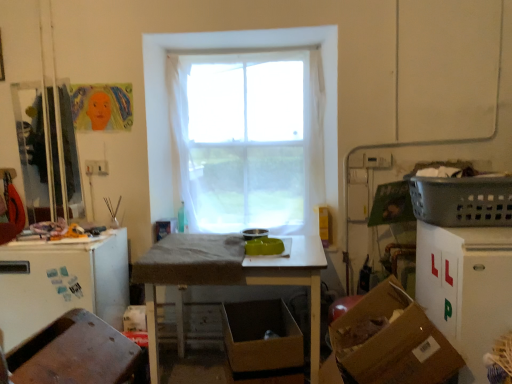
Question: Is brown cardboard box at lower right, acting as the 1th cardboard box starting from the front, surrounded by gray plastic laundry basket at right?

Choices:
 (A) no
 (B) yes

Answer: (A)

Question: From a real-world perspective, is gray plastic laundry basket at right located beneath brown cardboard box at lower right, acting as the 1th cardboard box starting from the front?

Choices:
 (A) yes
 (B) no

Answer: (B)

Question: Is gray plastic laundry basket at right at the right side of brown cardboard box at lower right, acting as the 1th cardboard box starting from the front?

Choices:
 (A) yes
 (B) no

Answer: (A)

Question: Can you confirm if gray plastic laundry basket at right is thinner than brown cardboard box at lower right, acting as the 1th cardboard box starting from the front?

Choices:
 (A) yes
 (B) no

Answer: (B)

Question: Does gray plastic laundry basket at right come behind brown cardboard box at lower right, the 2th cardboard box viewed from the left?

Choices:
 (A) yes
 (B) no

Answer: (A)

Question: Considering the positions of point (282, 327) and point (450, 369), is point (282, 327) closer or farther from the camera than point (450, 369)?

Choices:
 (A) farther
 (B) closer

Answer: (A)

Question: From a real-world perspective, relative to brown cardboard box at lower right, acting as the 1th cardboard box starting from the front, is brown cardboard box at lower center, the second cardboard box in the right-to-left sequence, vertically above or below?

Choices:
 (A) above
 (B) below

Answer: (B)

Question: Is brown cardboard box at lower center, marked as the first cardboard box in a back-to-front arrangement, taller or shorter than brown cardboard box at lower right, acting as the 1th cardboard box starting from the front?

Choices:
 (A) tall
 (B) short

Answer: (B)

Question: Is brown cardboard box at lower center, marked as the first cardboard box in a back-to-front arrangement, spatially inside brown cardboard box at lower right, which is the second cardboard box in back-to-front order, or outside of it?

Choices:
 (A) inside
 (B) outside

Answer: (B)

Question: From a real-world perspective, is white matte refrigerator at left physically located above or below gray plastic laundry basket at right?

Choices:
 (A) above
 (B) below

Answer: (B)

Question: Considering their positions, is white matte refrigerator at left located in front of or behind gray plastic laundry basket at right?

Choices:
 (A) behind
 (B) front

Answer: (A)

Question: Would you say white matte refrigerator at left is to the left or to the right of gray plastic laundry basket at right in the picture?

Choices:
 (A) right
 (B) left

Answer: (B)

Question: Considering the positions of white matte refrigerator at left and gray plastic laundry basket at right in the image, is white matte refrigerator at left bigger or smaller than gray plastic laundry basket at right?

Choices:
 (A) big
 (B) small

Answer: (A)

Question: From the image's perspective, is brown cardboard box at lower center, the second cardboard box in the right-to-left sequence, located above or below gray plastic laundry basket at right?

Choices:
 (A) below
 (B) above

Answer: (A)

Question: In terms of height, does brown cardboard box at lower center, arranged as the 2th cardboard box when viewed from the front, look taller or shorter compared to gray plastic laundry basket at right?

Choices:
 (A) tall
 (B) short

Answer: (A)